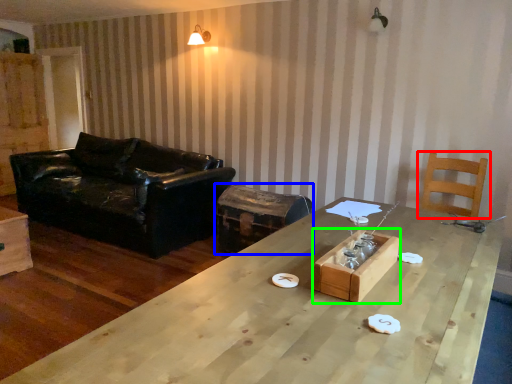
Question: Which object is positioned farthest from chair (highlighted by a red box)? Select from swivel chair (highlighted by a blue box) and crate (highlighted by a green box).

Choices:
 (A) swivel chair
 (B) crate

Answer: (B)